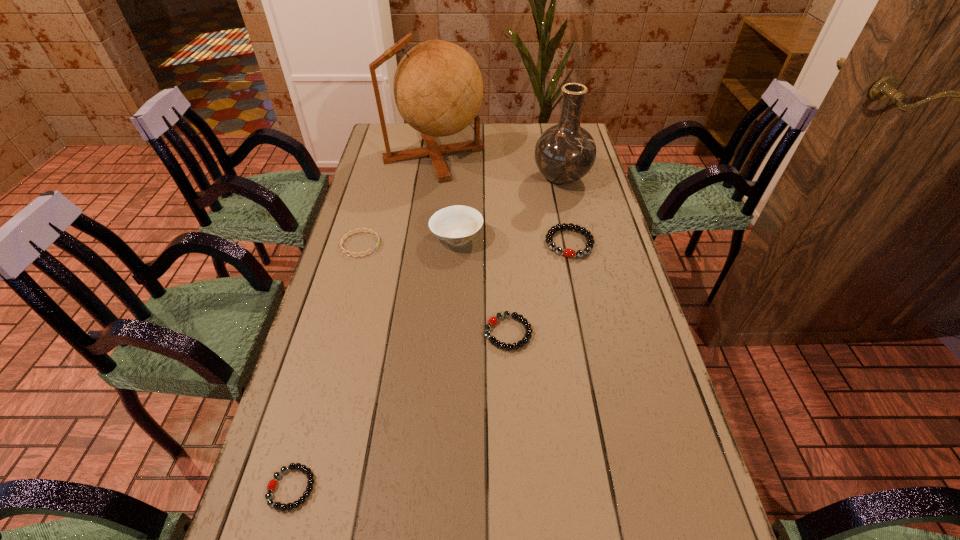
Locate an element on the screen. The height and width of the screenshot is (540, 960). vase positioned at the right edge is located at coordinates (564, 153).

The height and width of the screenshot is (540, 960). I want to click on bracelet situated at the right edge, so click(x=567, y=252).

You are a GUI agent. You are given a task and a screenshot of the screen. Output one action in this format:
    pyautogui.click(x=<x>, y=<y>)
    Task: Click on the object located in the far left corner section of the desktop
    
    Given the screenshot: What is the action you would take?
    (438, 89)

In the image, there is a desktop. Identify the location of free space at the left edge. (369, 202).

Where is `vacant space at the right edge of the desktop`? vacant space at the right edge of the desktop is located at coordinates (659, 383).

Locate an element on the screen. empty space between the fifth shortest object and the leftmost black bracelet is located at coordinates (374, 362).

Identify the location of free point between the bowl and the nearest object. This screenshot has width=960, height=540. (374, 362).

Find the location of `vacant space that's between the tallest object and the tallest bracelet`. vacant space that's between the tallest object and the tallest bracelet is located at coordinates (501, 199).

Identify the location of vacant area between the blue bracelet and the globe. The height and width of the screenshot is (540, 960). (397, 199).

This screenshot has height=540, width=960. I want to click on free space between the blue bracelet and the beige bowl, so click(x=409, y=241).